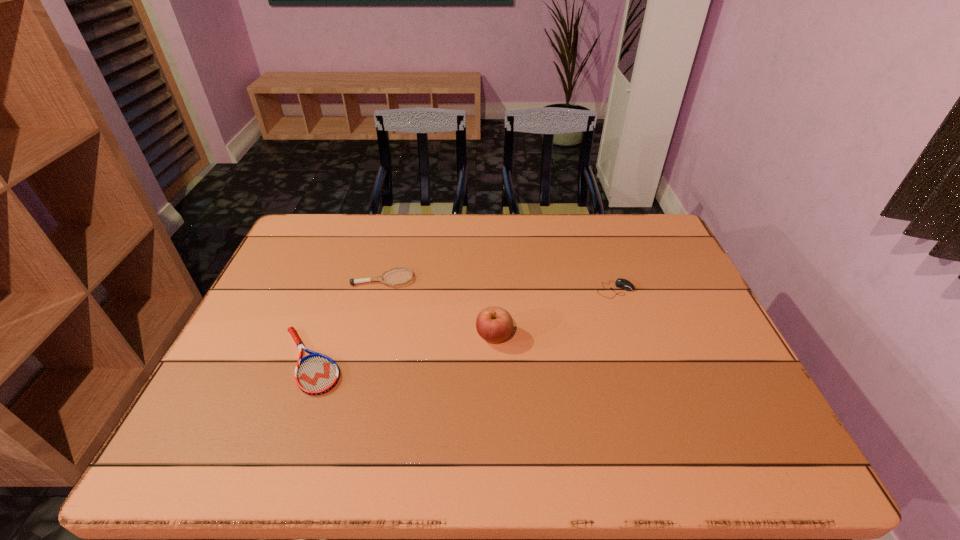
Locate an element on the screen. The height and width of the screenshot is (540, 960). free space between the taller tennis racket and the rightmost object is located at coordinates (499, 284).

You are a GUI agent. You are given a task and a screenshot of the screen. Output one action in this format:
    pyautogui.click(x=<x>, y=<y>)
    Task: Click on the vacant space in between the rightmost object and the nearer tennis racket
    Image resolution: width=960 pixels, height=540 pixels.
    Given the screenshot: What is the action you would take?
    pyautogui.click(x=463, y=325)

Find the location of a particular element. free spot between the rightmost object and the taller tennis racket is located at coordinates (499, 284).

In order to click on vacant area that lies between the taller tennis racket and the rightmost object in this screenshot , I will do `click(499, 284)`.

Locate an element on the screen. Image resolution: width=960 pixels, height=540 pixels. vacant space that is in between the tallest object and the rightmost object is located at coordinates (555, 313).

Image resolution: width=960 pixels, height=540 pixels. In order to click on vacant space in between the apple and the shortest object in this screenshot , I will do `click(402, 348)`.

Identify the location of free space between the nearer tennis racket and the tallest object. (402, 348).

Point out which object is positioned as the nearest to the rightmost object. Please provide its 2D coordinates. Your answer should be formatted as a tuple, i.e. [(x, y)], where the tuple contains the x and y coordinates of a point satisfying the conditions above.

[(494, 324)]

Where is `object that can be found as the third closest to the third object from left to right`? object that can be found as the third closest to the third object from left to right is located at coordinates (315, 374).

You are a GUI agent. You are given a task and a screenshot of the screen. Output one action in this format:
    pyautogui.click(x=<x>, y=<y>)
    Task: Click on the vacant point that satisfies the following two spatial constraints: 1. on the front side of the taller tennis racket; 2. on the left side of the rightmost object
    This screenshot has height=540, width=960.
    Given the screenshot: What is the action you would take?
    pyautogui.click(x=380, y=289)